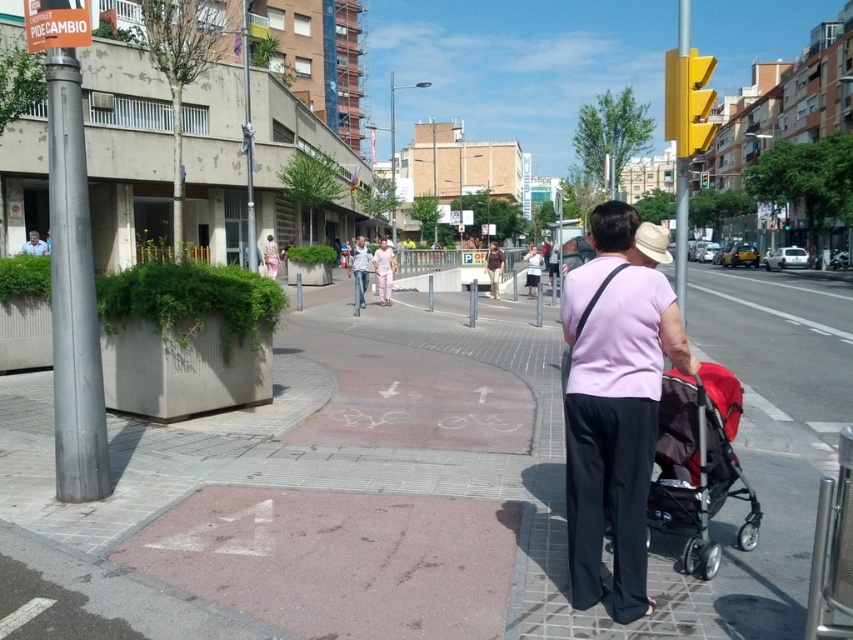
You are a delivery person standing at the start of the pedestrian path marked with white arrows. You need to deliver a package to the person wearing the pink fabric shirt at center and then to the person in the light brown leather jacket at center. What is the shortest path you can take to reach both destinations in order?

The shortest path would be to first go straight along the pedestrian path marked with white arrows towards the pink fabric shirt at center, then proceed further along the same path to reach the light brown leather jacket at center since they are aligned in the same direction. The pink fabric shirt at center is closer, being only 27.83 meters away from the light brown leather jacket at center.

You are a delivery person with a cart that requires a 15 meter straight path to maneuver safely. You see the pink concrete pavement at center and the light brown leather jacket at center in the scene. Can you safely navigate your cart between these two points?

The distance between the pink concrete pavement at center and the light brown leather jacket at center is 14.87 meters, which is slightly less than the required 15 meters. Therefore, the cart cannot safely navigate between these two points due to insufficient space.

You are a fashion designer observing the urban street scene. You notice the pink fabric shirt at center and the light brown leather jacket at center. Which clothing item is shorter in height?

The pink fabric shirt at center is shorter in height than the light brown leather jacket at center.